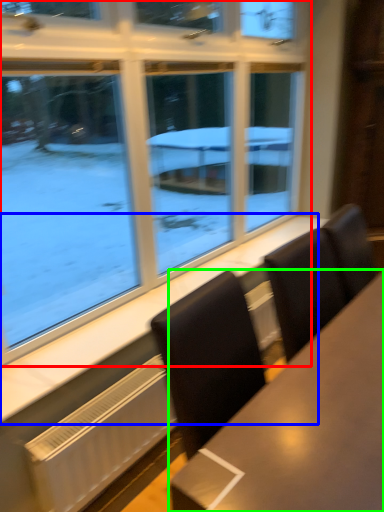
Question: Based on their relative distances, which object is nearer to window (highlighted by a red box)? Choose from window sill (highlighted by a blue box) and table (highlighted by a green box).

Choices:
 (A) window sill
 (B) table

Answer: (A)